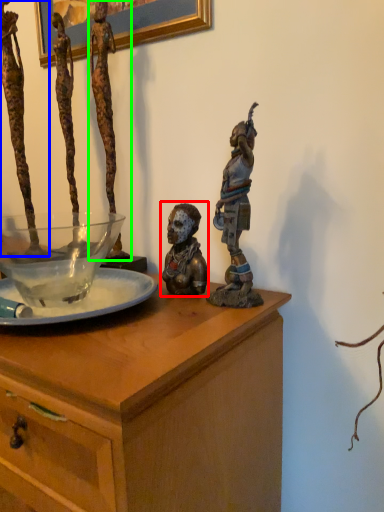
Question: Which object is the farthest from person (highlighted by a red box)? Choose among these: person (highlighted by a blue box) or person (highlighted by a green box).

Choices:
 (A) person
 (B) person

Answer: (A)